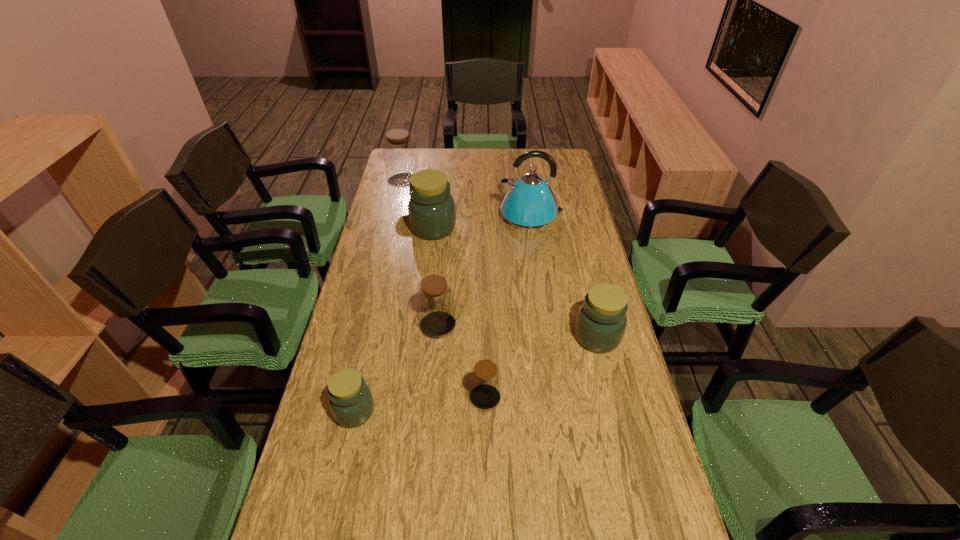
Identify the location of free point between the farthest brown jar and the second brown jar from right to left. Image resolution: width=960 pixels, height=540 pixels. (420, 253).

Image resolution: width=960 pixels, height=540 pixels. I want to click on vacant region between the rightmost green jar and the nearest brown jar, so click(541, 367).

In order to click on vacant space that's between the second farthest green jar and the second nearest brown jar in this screenshot , I will do `click(517, 330)`.

At what (x,y) coordinates should I click in order to perform the action: click on vacant area between the nearest brown jar and the second brown jar from right to left. Please return your answer as a coordinate pair (x, y). This screenshot has width=960, height=540. Looking at the image, I should click on (462, 361).

The height and width of the screenshot is (540, 960). In order to click on vacant area that lies between the second smallest green jar and the second farthest jar in this screenshot , I will do `click(516, 282)`.

Select which object is the fourth closest to the second farthest green jar. Please provide its 2D coordinates. Your answer should be formatted as a tuple, i.e. [(x, y)], where the tuple contains the x and y coordinates of a point satisfying the conditions above.

[(431, 208)]

The height and width of the screenshot is (540, 960). I want to click on the second closest object relative to the second farthest jar, so click(x=400, y=156).

Where is `jar that is the third closest to the kettle`? Image resolution: width=960 pixels, height=540 pixels. jar that is the third closest to the kettle is located at coordinates coord(435,301).

Select which jar is the third closest to the second smallest brown jar. Please provide its 2D coordinates. Your answer should be formatted as a tuple, i.e. [(x, y)], where the tuple contains the x and y coordinates of a point satisfying the conditions above.

[(431, 208)]

Locate an element on the screen. Image resolution: width=960 pixels, height=540 pixels. brown jar that is the second closest to the fifth nearest jar is located at coordinates (435, 301).